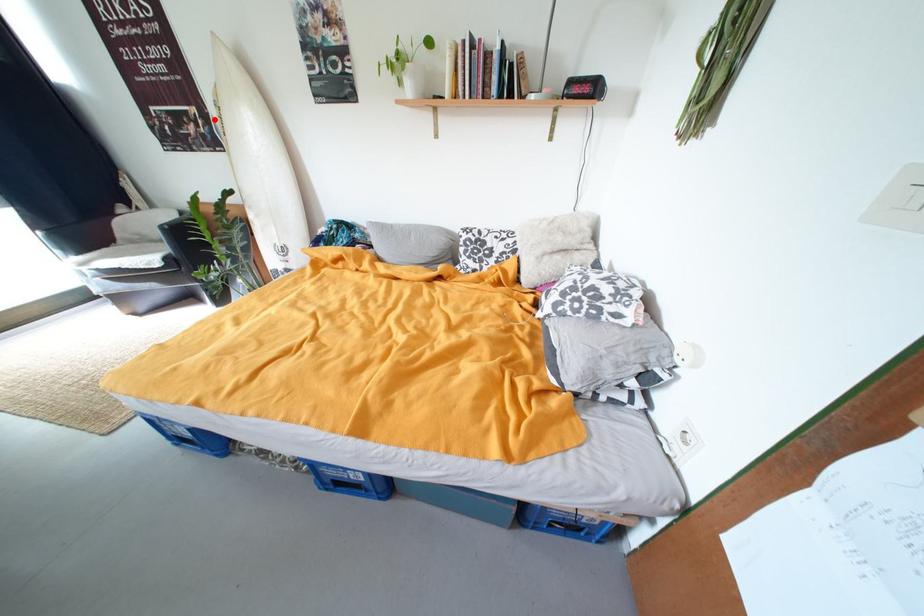
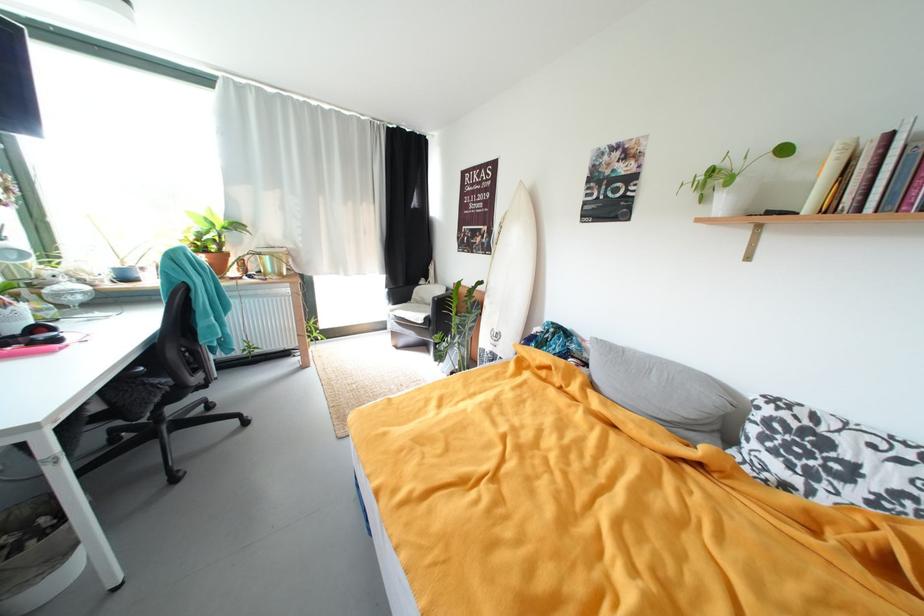
In the second image, find the point that corresponds to the highlighted location in the first image.

(497, 235)